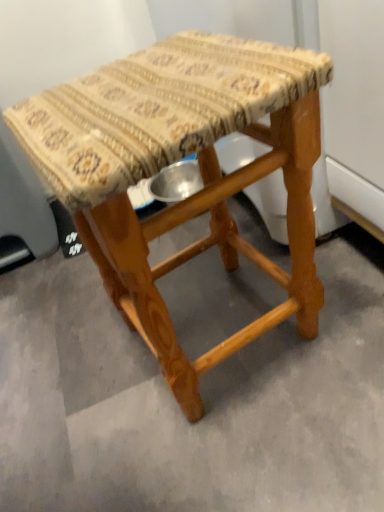
Identify the location of wooden stool at center. This screenshot has width=384, height=512. (177, 159).

Image resolution: width=384 pixels, height=512 pixels. Describe the element at coordinates (177, 159) in the screenshot. I see `wooden stool at center` at that location.

Locate an element on the screen. wooden stool at center is located at coordinates (177, 159).